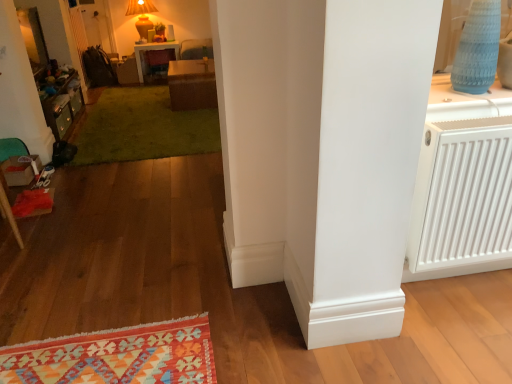
Describe the element at coordinates (192, 84) in the screenshot. This screenshot has height=384, width=512. I see `brown woven table at center, which is counted as the second table, starting from the back` at that location.

This screenshot has width=512, height=384. Describe the element at coordinates (143, 127) in the screenshot. I see `green plush rug at center` at that location.

The image size is (512, 384). I want to click on velvet red armchair at center, so click(x=158, y=65).

This screenshot has height=384, width=512. I want to click on matte yellow lamp at upper center, so click(141, 15).

Where is `matte white table at upper center, the first table positioned from the back`? This screenshot has height=384, width=512. matte white table at upper center, the first table positioned from the back is located at coordinates (153, 49).

You are a GUI agent. You are given a task and a screenshot of the screen. Output one action in this format:
    pyautogui.click(x=<x>, y=<y>)
    Task: Click on the brown woven table at center, the second table when ordered from top to bottom
    This screenshot has width=512, height=384.
    Given the screenshot: What is the action you would take?
    click(192, 84)

Which object is positioned more to the right, brown woven table at center, the second table when ordered from top to bottom, or matte yellow lamp at upper center?

From the viewer's perspective, brown woven table at center, the second table when ordered from top to bottom, appears more on the right side.

Would you say matte yellow lamp at upper center is part of brown woven table at center, which is the first table in right-to-left order,'s contents?

No, brown woven table at center, which is the first table in right-to-left order, does not contain matte yellow lamp at upper center.

In terms of height, does brown woven table at center, the second table when ordered from top to bottom, look taller or shorter compared to matte yellow lamp at upper center?

In the image, brown woven table at center, the second table when ordered from top to bottom, appears to be shorter than matte yellow lamp at upper center.

Is brown woven table at center, which is the first table in front-to-back order, oriented away from matte yellow lamp at upper center?

No, brown woven table at center, which is the first table in front-to-back order, is not facing the opposite direction of matte yellow lamp at upper center.

Is green plush rug at center not within brown woven table at center, which is counted as the 1th table, starting from the bottom?

green plush rug at center is positioned outside brown woven table at center, which is counted as the 1th table, starting from the bottom.

Is green plush rug at center further to the viewer compared to brown woven table at center, which is counted as the second table, starting from the back?

No, it is not.

Which is more to the left, green plush rug at center or brown woven table at center, which is the first table in front-to-back order?

green plush rug at center is more to the left.

Considering the positions of objects matte white table at upper center, which is the 1th table in top-to-bottom order, and wooden dresser at left in the image provided, who is more to the left, matte white table at upper center, which is the 1th table in top-to-bottom order, or wooden dresser at left?

wooden dresser at left.

Is matte white table at upper center, positioned as the 2th table in right-to-left order, shorter than wooden dresser at left?

In fact, matte white table at upper center, positioned as the 2th table in right-to-left order, may be taller than wooden dresser at left.

From a real-world perspective, who is located lower, matte white table at upper center, which is the second table from front to back, or wooden dresser at left?

From a 3D spatial view, wooden dresser at left is below.

From the image's perspective, which table is the 2nd one above the wooden dresser at left? Please provide its 2D coordinates.

[(153, 49)]

Who is smaller, velvet red armchair at center or white plastic radiator at right?

Smaller between the two is white plastic radiator at right.

Could you tell me if velvet red armchair at center is facing white plastic radiator at right?

Yes, velvet red armchair at center is turned towards white plastic radiator at right.

From the image's perspective, is velvet red armchair at center over white plastic radiator at right?

Yes, from the image's perspective, velvet red armchair at center is above white plastic radiator at right.

Can you tell me how much velvet red armchair at center and white plastic radiator at right differ in facing direction?

1.09 degrees.

Is the position of velvet red armchair at center less distant than that of matte yellow lamp at upper center?

That is False.

From a real-world perspective, does velvet red armchair at center stand above matte yellow lamp at upper center?

No, from a real-world perspective, velvet red armchair at center is not above matte yellow lamp at upper center.

Find the location of a particular element. Image resolution: width=512 pixels, height=384 pixels. armchair behind the matte yellow lamp at upper center is located at coordinates (158, 65).

Is point (163, 82) more distant than point (138, 12)?

No, (163, 82) is closer to viewer.

Is wooden dresser at left directly adjacent to brown woven table at center, the second table when ordered from top to bottom?

No, wooden dresser at left is not beside brown woven table at center, the second table when ordered from top to bottom.

Does wooden dresser at left appear on the left side of brown woven table at center, which is counted as the 1th table, starting from the bottom?

Yes, wooden dresser at left is to the left of brown woven table at center, which is counted as the 1th table, starting from the bottom.

Between wooden dresser at left and brown woven table at center, marked as the 2th table in a left-to-right arrangement, which one has smaller width?

wooden dresser at left.

From the image's perspective, is wooden dresser at left positioned above or below brown woven table at center, marked as the 2th table in a left-to-right arrangement?

wooden dresser at left is situated lower than brown woven table at center, marked as the 2th table in a left-to-right arrangement, in the image.

From the image's perspective, is white plastic radiator at right beneath velvet red armchair at center?

Yes, from the image's perspective, white plastic radiator at right is beneath velvet red armchair at center.

Is point (448, 257) positioned after point (158, 77)?

That is False.

Between white plastic radiator at right and velvet red armchair at center, which one has less height?

→ Standing shorter between the two is velvet red armchair at center.

Locate an element on the screen. Image resolution: width=512 pixels, height=384 pixels. lamp on the left of brown woven table at center, which is counted as the second table, starting from the back is located at coordinates (141, 15).

In order to click on table that is the 1st one when counting backward from the green plush rug at center in this screenshot , I will do [192, 84].

Considering their positions, is matte white table at upper center, the 2th table in the bottom-to-top sequence, positioned closer to green plush rug at center than matte yellow lamp at upper center?

matte white table at upper center, the 2th table in the bottom-to-top sequence.

Which object lies nearer to the anchor point white plastic radiator at right, wooden dresser at left or brown woven table at center, the second table when ordered from top to bottom?

brown woven table at center, the second table when ordered from top to bottom, is closer to white plastic radiator at right.

Consider the image. Estimate the real-world distances between objects in this image. Which object is closer to matte yellow lamp at upper center, wooden dresser at left or green plush rug at center?

wooden dresser at left.

Based on their spatial positions, is white plastic radiator at right or green plush rug at center closer to velvet red armchair at center?

green plush rug at center lies closer to velvet red armchair at center than the other object.

Considering their positions, is brown woven table at center, marked as the 2th table in a left-to-right arrangement, positioned closer to matte yellow lamp at upper center than velvet red armchair at center?

Based on the image, velvet red armchair at center appears to be nearer to matte yellow lamp at upper center.

In the scene shown: Which object lies further to the anchor point velvet red armchair at center, matte white table at upper center, the first table positioned from the back, or white plastic radiator at right?

white plastic radiator at right lies further to velvet red armchair at center than the other object.

Based on the photo, looking at the image, which one is located closer to green plush rug at center, velvet red armchair at center or wooden dresser at left?

wooden dresser at left is closer to green plush rug at center.

Based on the photo, estimate the real-world distances between objects in this image. Which object is further from matte yellow lamp at upper center, wooden dresser at left or velvet red armchair at center?

Among the two, wooden dresser at left is located further to matte yellow lamp at upper center.

Where is `dresser between green plush rug at center and matte white table at upper center, which is the 1th table in top-to-bottom order, along the z-axis`? This screenshot has height=384, width=512. dresser between green plush rug at center and matte white table at upper center, which is the 1th table in top-to-bottom order, along the z-axis is located at coordinates (60, 99).

Where is `lamp between green plush rug at center and velvet red armchair at center in the front-back direction`? The image size is (512, 384). lamp between green plush rug at center and velvet red armchair at center in the front-back direction is located at coordinates (141, 15).

Identify the location of table between brown woven table at center, which is counted as the 1th table, starting from the bottom, and velvet red armchair at center from front to back. (153, 49).

Locate an element on the screen. The height and width of the screenshot is (384, 512). table located between wooden dresser at left and matte yellow lamp at upper center in the depth direction is located at coordinates (192, 84).